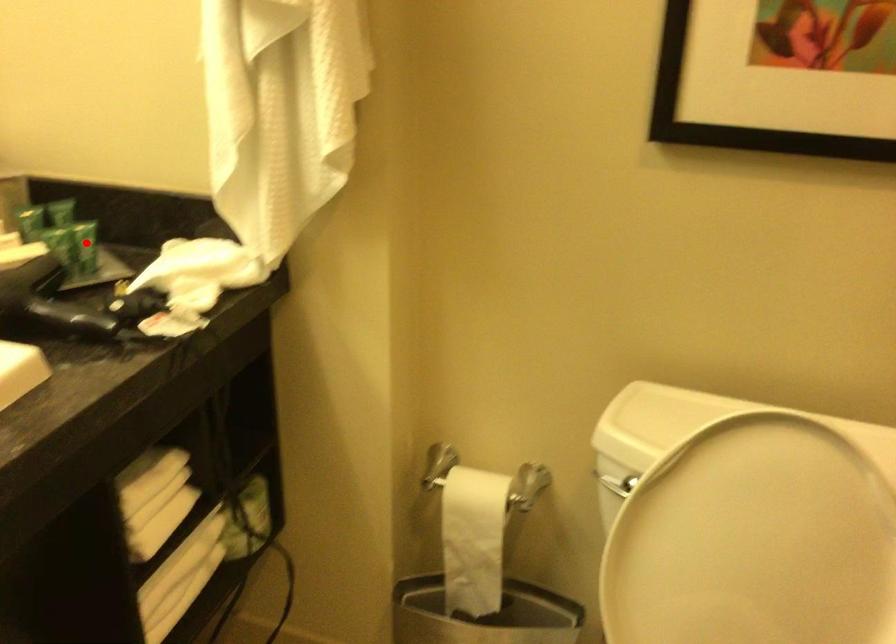
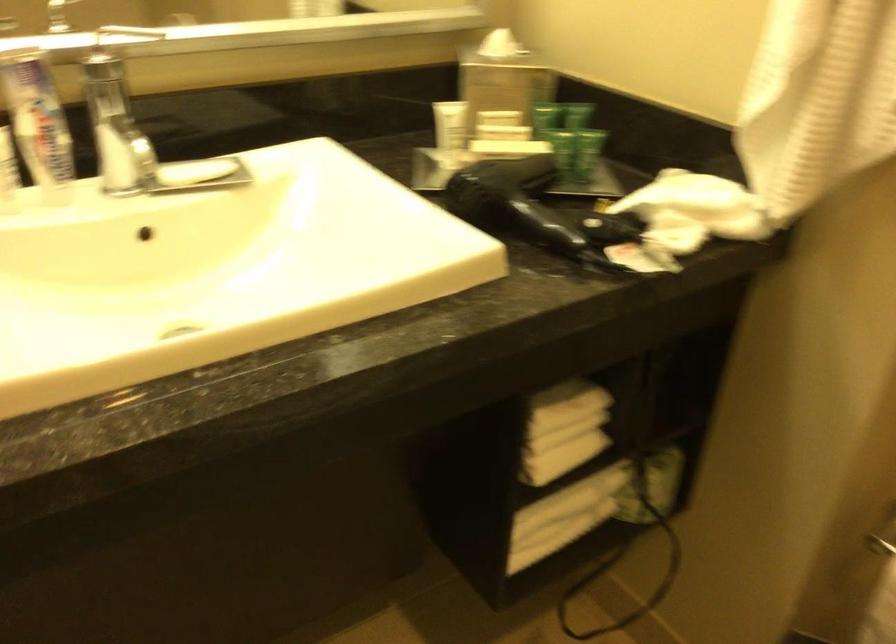
The point at the highlighted location is marked in the first image. Where is the corresponding point in the second image?

(589, 151)